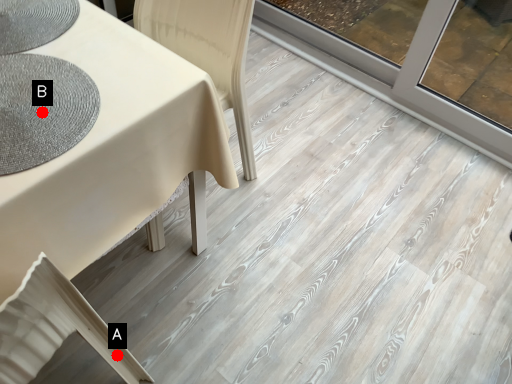
Question: Two points are circled on the image, labeled by A and B beside each circle. Among these points, which one is nearest to the camera?

Choices:
 (A) A is closer
 (B) B is closer

Answer: (B)